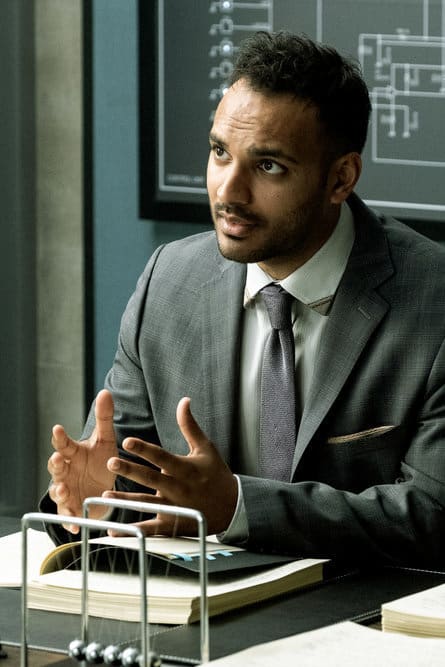
This screenshot has height=667, width=445. In order to click on door facing in this screenshot , I will do `click(70, 119)`.